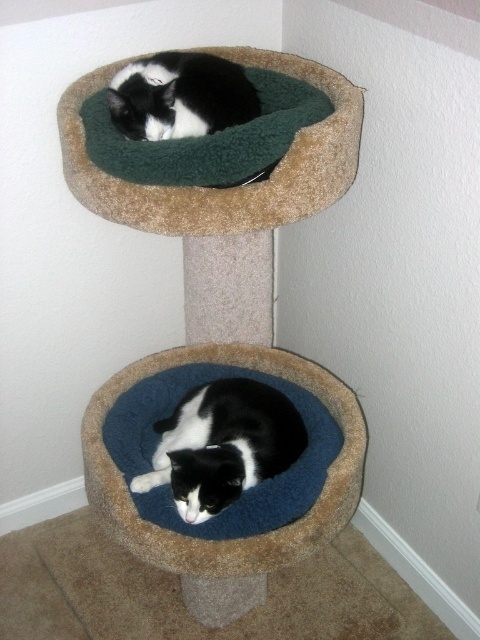
Question: Which object is farther from the camera taking this photo?

Choices:
 (A) black fuzzy cat at upper center
 (B) blue fuzzy cat bed at lower center

Answer: (A)

Question: Can you confirm if blue fuzzy cat bed at lower center is positioned to the right of black fuzzy cat at upper center?

Choices:
 (A) yes
 (B) no

Answer: (A)

Question: Which of the following is the closest to the observer?

Choices:
 (A) blue fuzzy cat bed at lower center
 (B) black fuzzy cat at upper center

Answer: (A)

Question: Does green plush cat bed at upper center appear under black and white fur cat at lower center?

Choices:
 (A) no
 (B) yes

Answer: (A)

Question: Can you confirm if black and white fur cat at lower center is thinner than black fuzzy cat at upper center?

Choices:
 (A) yes
 (B) no

Answer: (B)

Question: Estimate the real-world distances between objects in this image. Which object is closer to the green plush cat bed at upper center?

Choices:
 (A) blue fuzzy cat bed at lower center
 (B) black and white fur cat at lower center
 (C) black fuzzy cat at upper center

Answer: (C)